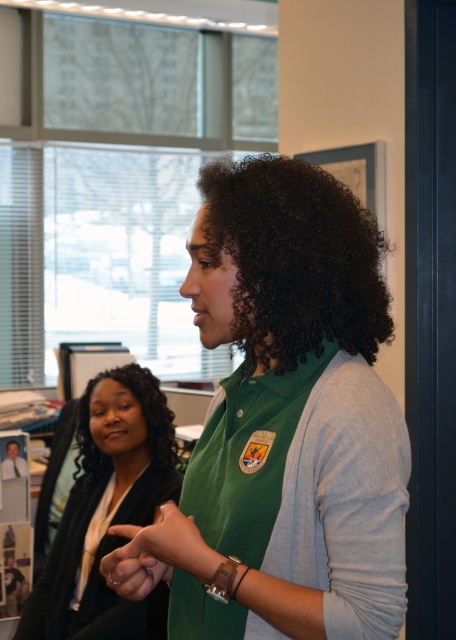
You are an interior designer assessing the placement of items in an office. You notice the matte black jacket at left and the silver metallic ring at center. Which object is positioned lower in the image?

The matte black jacket at left is below the silver metallic ring at center, so the matte black jacket at left is positioned lower in the image.

You are standing in the office scene and want to reach the point at coordinates (134, 394). The camera is positioned such that the point is 8.20 feet away. If you take a step forward, how much closer will you be to the point?

The point at coordinates (134, 394) is 8.20 feet away from the camera. If you take a step forward, you would reduce the distance by approximately the length of your step, but the exact distance closer depends on your step length. However, since the question doesn

You are standing in the office scene and want to move from point A to point B. Point A is at coordinate point(264,292) and point B is at coordinate point(81,525). Which point is closer to you?

Point(264,292) is closer to the viewer than point(81,525).